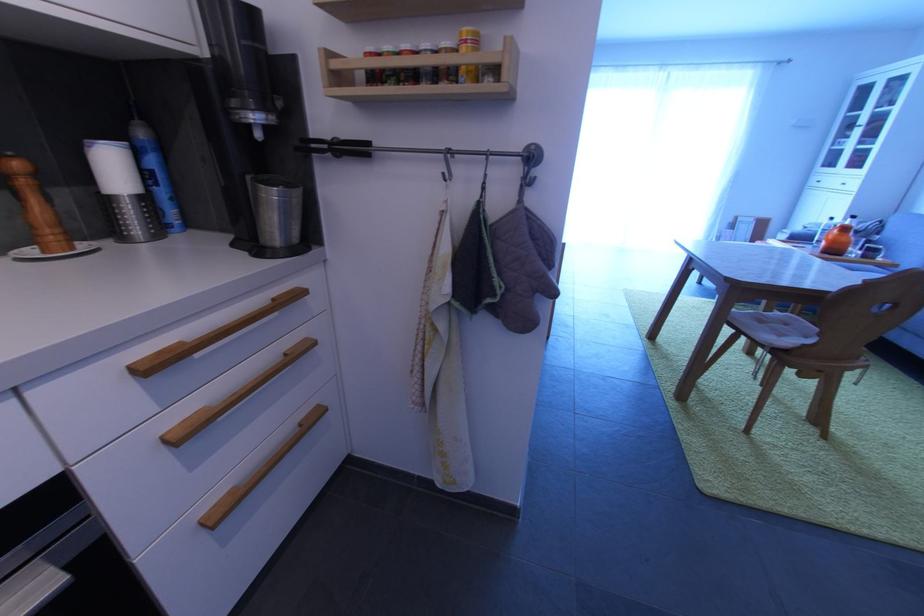
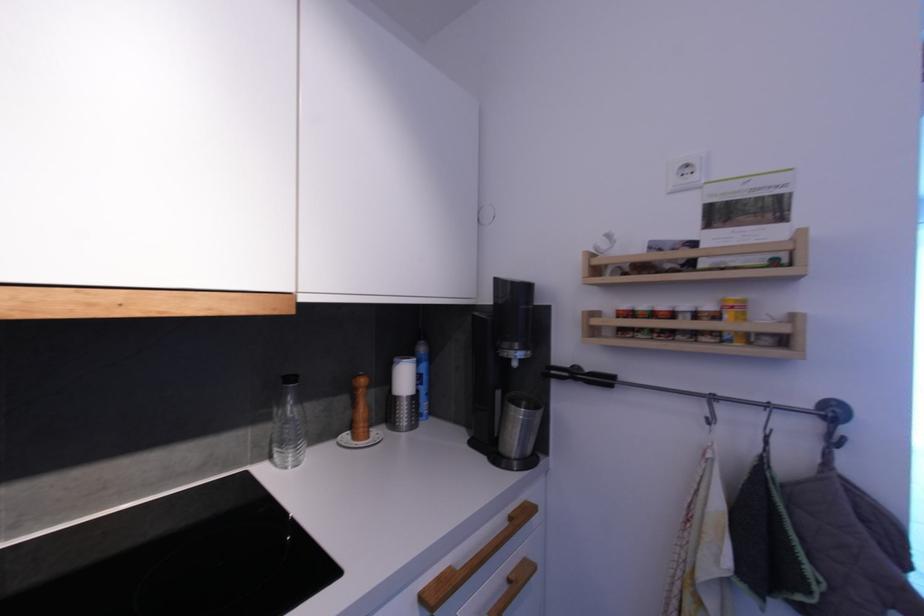
Locate, in the second image, the point that corresponds to (x=312, y=347) in the first image.

(532, 570)